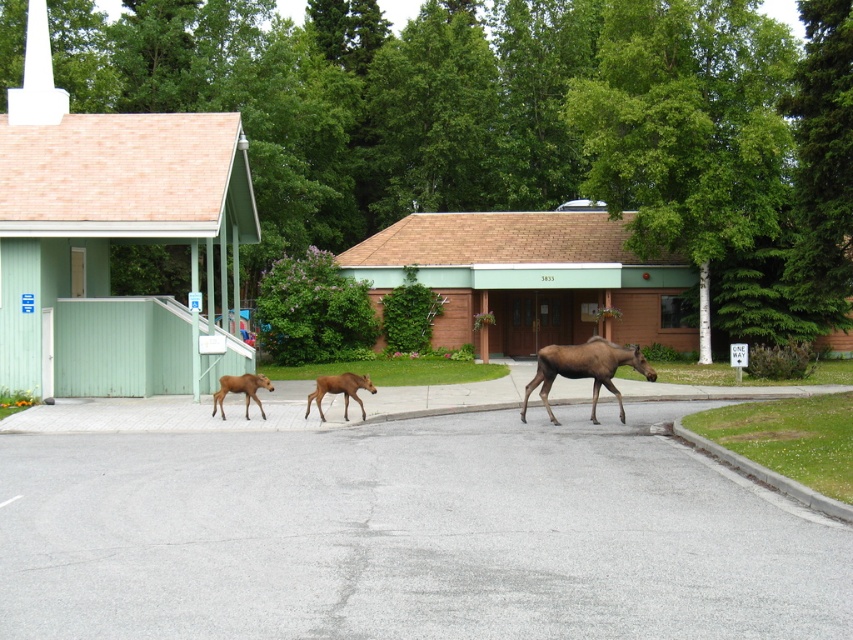
Does point (636, 365) lie in front of point (368, 376)?

Yes.

Does brown matte moose at center have a greater height compared to brown furry calf at center?

Indeed, brown matte moose at center has a greater height compared to brown furry calf at center.

The height and width of the screenshot is (640, 853). In order to click on brown matte moose at center in this screenshot , I will do `click(584, 369)`.

Find the location of `brown matte moose at center`. brown matte moose at center is located at coordinates (584, 369).

Does brown matte moose at center have a larger size compared to brown velvet calf at center?

Yes.

Between point (550, 368) and point (221, 401), which one is positioned in front?

Positioned in front is point (550, 368).

Identify the location of brown matte moose at center. Image resolution: width=853 pixels, height=640 pixels. tap(584, 369).

Can you confirm if brown furry calf at center is positioned above brown velvet calf at center?

Actually, brown furry calf at center is below brown velvet calf at center.

Does brown furry calf at center have a lesser height compared to brown velvet calf at center?

Incorrect, brown furry calf at center's height does not fall short of brown velvet calf at center's.

Is point (321, 384) less distant than point (215, 401)?

Yes, it is in front of point (215, 401).

Find the location of a particular element. brown furry calf at center is located at coordinates (339, 390).